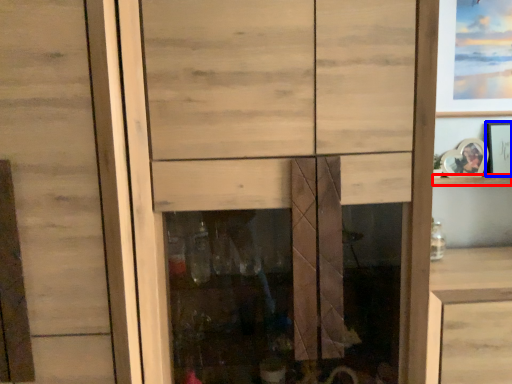
Question: Which object appears closest to the camera in this image, shelf (highlighted by a red box) or picture frame (highlighted by a blue box)?

Choices:
 (A) shelf
 (B) picture frame

Answer: (B)